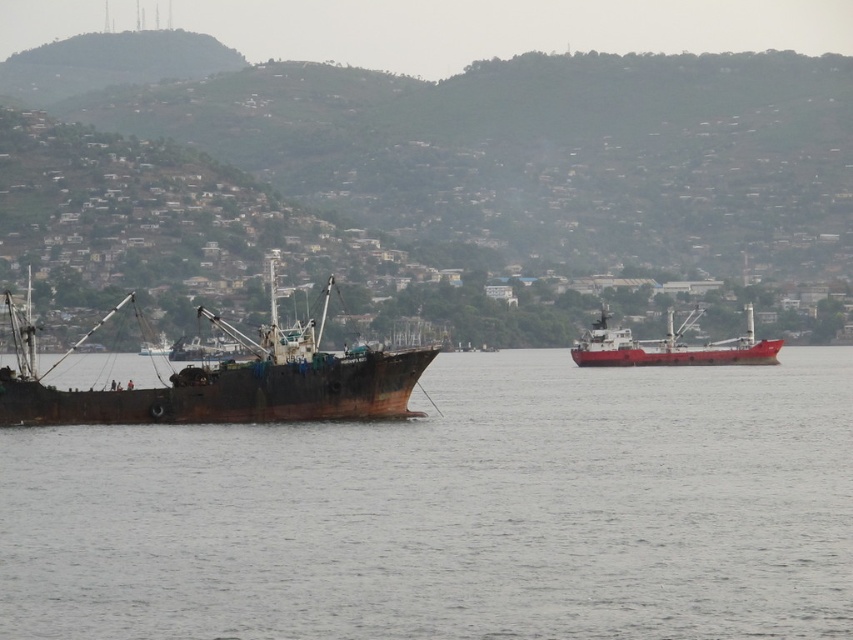
You are a marine biologist observing the coastal scene. You need to determine the spatial relationship between the gray matte water at center and the rusty metal ship at left. Which object is wider?

The gray matte water at center is wider than the rusty metal ship at left according to the description.

You are a sailor trying to navigate a small boat between the rusty metal ship at left and the red matte cargo ship at center. Based on their positions, can you safely pass through the space between them?

The rusty metal ship at left is in front of the red matte cargo ship at center, so there is no space between them for your boat to pass through safely.